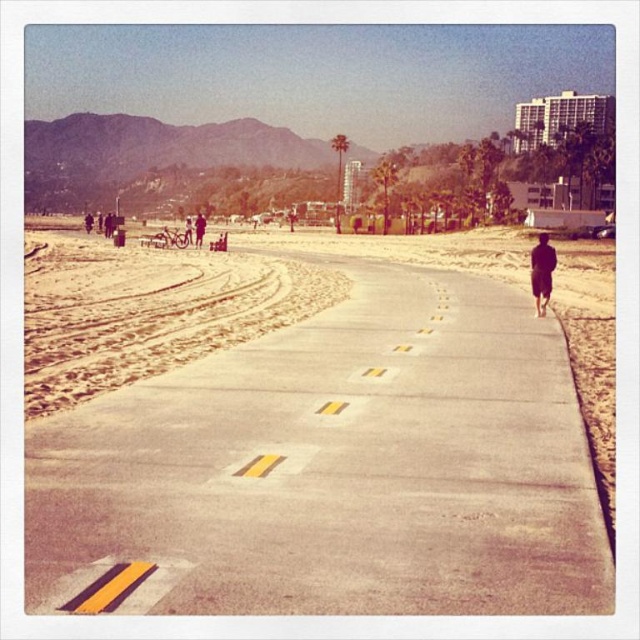
Can you confirm if sandy yellow at left is wider than black matte jacket at right?

Correct, the width of sandy yellow at left exceeds that of black matte jacket at right.

Is sandy yellow at left in front of black matte jacket at right?

Yes, it is.

Between point (134, 264) and point (541, 300), which one is positioned in front?

Point (541, 300) is in front.

Identify the location of sandy yellow at left. The width and height of the screenshot is (640, 640). (148, 312).

This screenshot has height=640, width=640. Describe the element at coordinates (339, 465) in the screenshot. I see `concrete at center` at that location.

Does concrete at center have a lesser height compared to sandy yellow at left?

Indeed, concrete at center has a lesser height compared to sandy yellow at left.

Which is in front, point (182, 500) or point (74, 365)?

Point (182, 500) is in front.

I want to click on concrete at center, so click(x=339, y=465).

Does sandy yellow at left appear on the left side of dark blue fabric at center?

Incorrect, sandy yellow at left is not on the left side of dark blue fabric at center.

This screenshot has width=640, height=640. What do you see at coordinates (148, 312) in the screenshot? I see `sandy yellow at left` at bounding box center [148, 312].

Locate an element on the screen. The image size is (640, 640). sandy yellow at left is located at coordinates (148, 312).